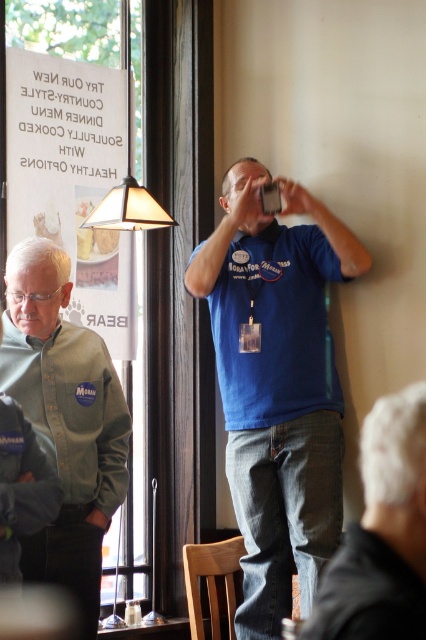
Between blue cotton shirt at upper center and translucent glass lampshade at upper left, which one appears on the left side from the viewer's perspective?

translucent glass lampshade at upper left

Which is in front, point (307, 342) or point (138, 205)?

Point (307, 342)

The height and width of the screenshot is (640, 426). I want to click on blue cotton shirt at upper center, so click(x=276, y=385).

Is point (226, 340) positioned in front of point (37, 305)?

No, it is not.

Is blue cotton shirt at upper center above green button-down shirt at left?

Correct, blue cotton shirt at upper center is located above green button-down shirt at left.

Describe the element at coordinates (276, 385) in the screenshot. I see `blue cotton shirt at upper center` at that location.

The image size is (426, 640). I want to click on blue cotton shirt at upper center, so click(276, 385).

Can you confirm if green button-down shirt at left is thinner than white paper sign at upper left?

Indeed, green button-down shirt at left has a lesser width compared to white paper sign at upper left.

From the picture: Which is more to the left, green button-down shirt at left or white paper sign at upper left?

Positioned to the left is white paper sign at upper left.

Is point (60, 538) in front of point (115, 173)?

Yes.

This screenshot has height=640, width=426. I want to click on green button-down shirt at left, so click(x=65, y=419).